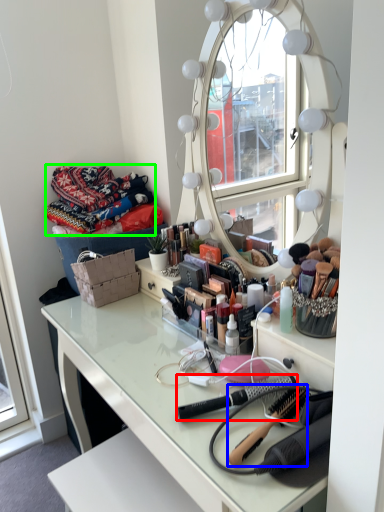
Question: Which object is the farthest from brush (highlighted by a red box)? Choose among these: brush (highlighted by a blue box) or material (highlighted by a green box).

Choices:
 (A) brush
 (B) material

Answer: (B)